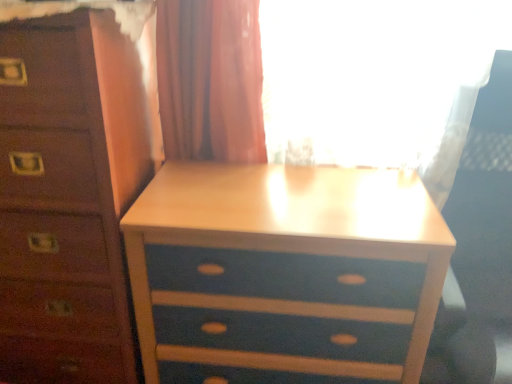
Where is `free space above blue painted wood nightstand at center (from a real-world perspective)`? Image resolution: width=512 pixels, height=384 pixels. free space above blue painted wood nightstand at center (from a real-world perspective) is located at coordinates (283, 195).